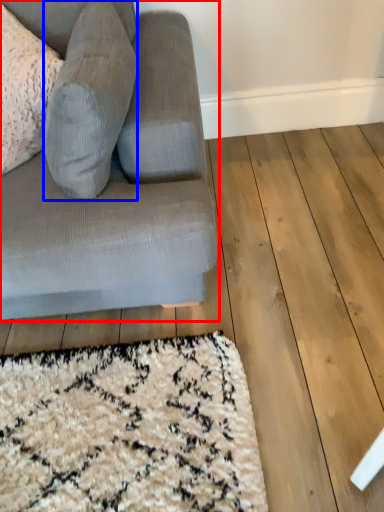
Question: Which of the following is the farthest to the observer, studio couch (highlighted by a red box) or gray (highlighted by a blue box)?

Choices:
 (A) studio couch
 (B) gray

Answer: (B)